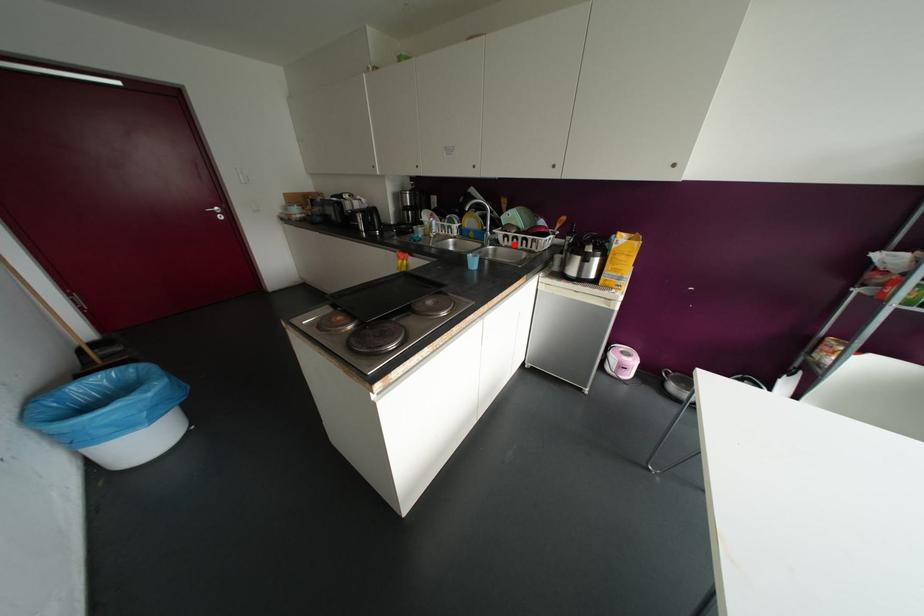
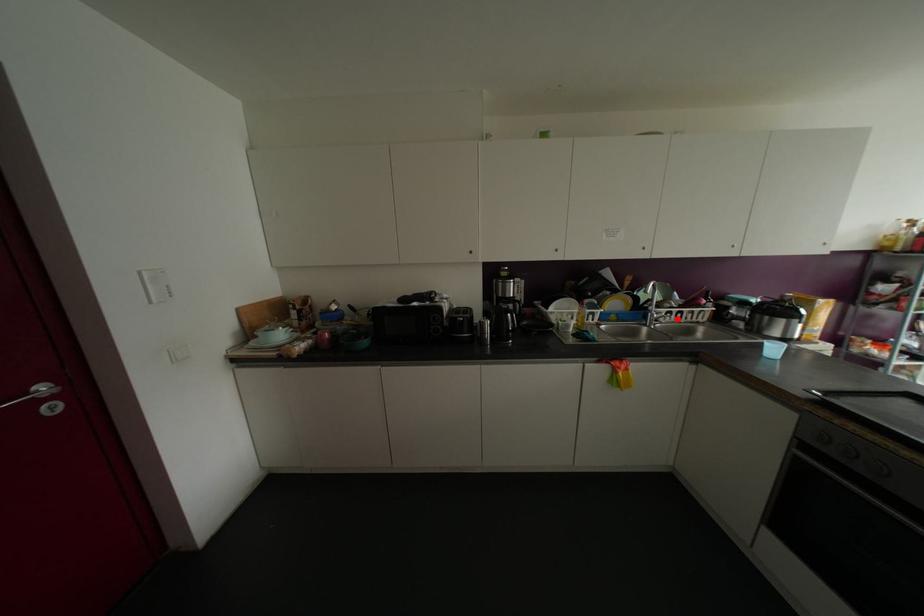
I am providing you with two images of the same scene from different viewpoints. A red point is marked on the first image and another point is marked on the second image. Are the points marked in image1 and image2 representing the same 3D position?

Yes